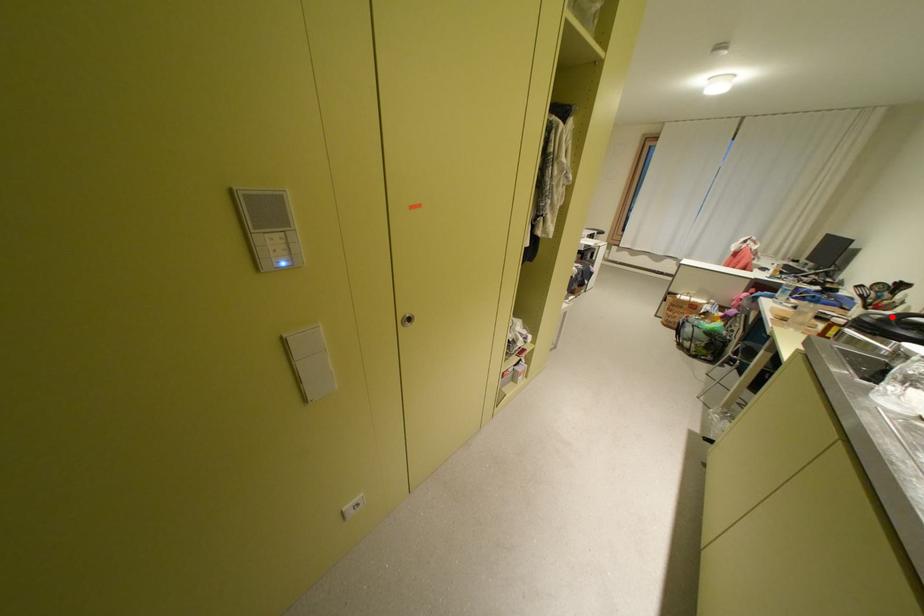
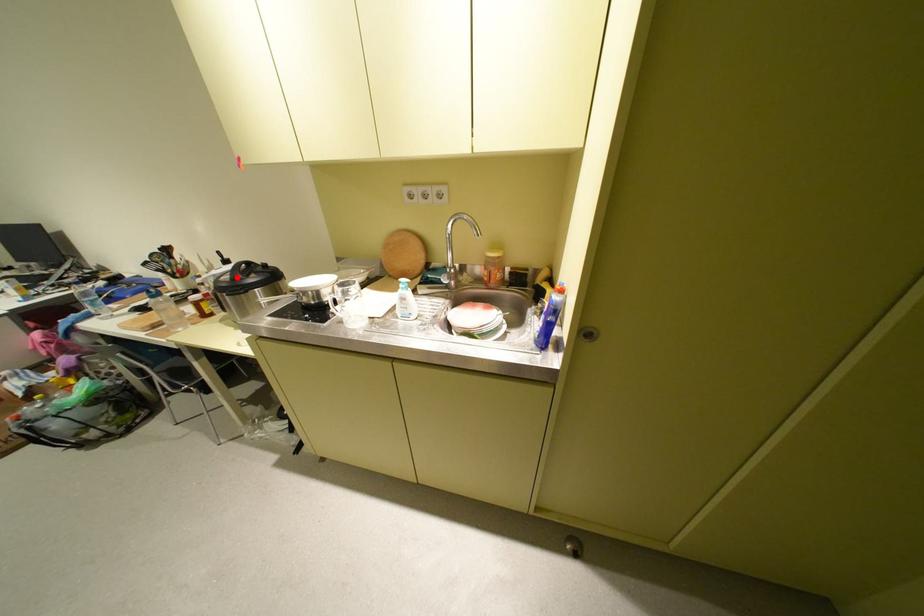
I am providing you with two images of the same scene from different viewpoints. A red point is marked on the first image and another point is marked on the second image. Is the red point in image1 aligned with the point shown in image2?

Yes